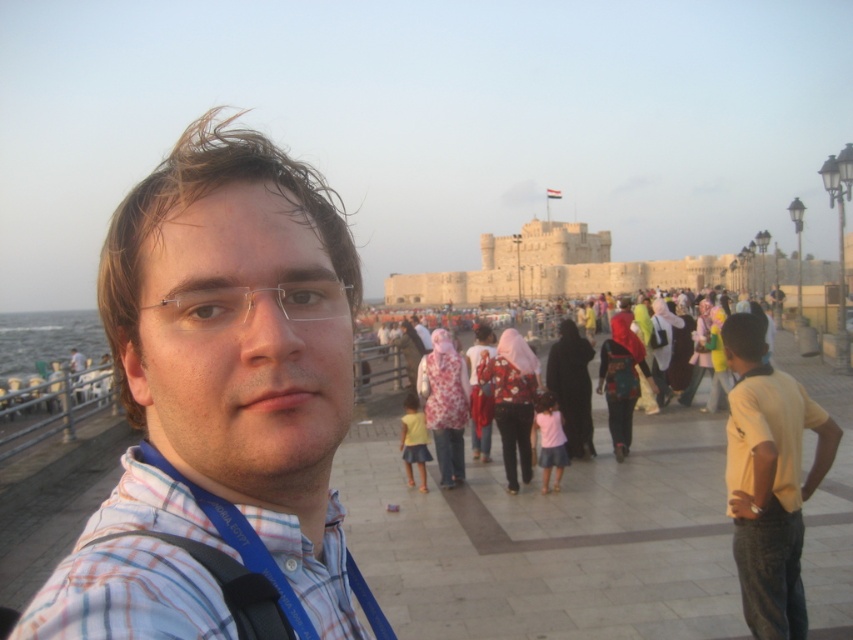
You are a tour guide at the historical site. You notice two items in the image that need to be included in your tour description. The yellow cotton shirt at right and the black fabric suspenders at lower left. Which of these items is positioned higher up in the image?

The yellow cotton shirt at right is positioned higher up in the image as it is much taller than the black fabric suspenders at lower left.

You are a tour guide at the historical site and notice a tourist wearing a yellow cotton shirt at right and another wearing black fabric suspenders at lower left. Which tourist is closer to you?

The yellow cotton shirt at right is closer to you because the black fabric suspenders at lower left is behind it, meaning the yellow cotton shirt is in front and therefore nearer.